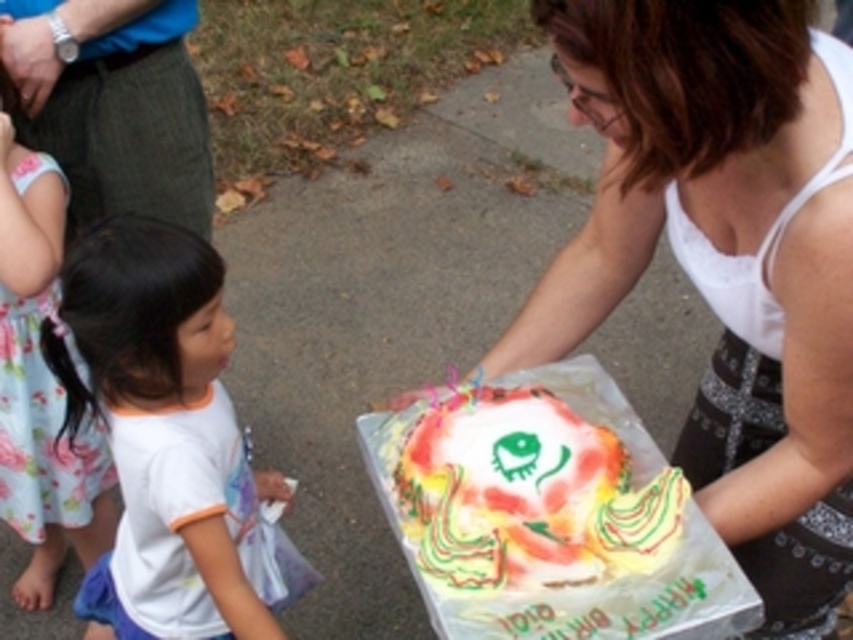
Question: Can you confirm if white matte tank top at center is thinner than white cotton shirt at lower left?

Choices:
 (A) no
 (B) yes

Answer: (A)

Question: Which is nearer to the white cotton shirt at lower left?

Choices:
 (A) floral fabric dress at lower left
 (B) white matte tank top at center

Answer: (A)

Question: Estimate the real-world distances between objects in this image. Which object is closer to the white cotton shirt at lower left?

Choices:
 (A) floral fabric dress at lower left
 (B) colorful frosting cake at center

Answer: (A)

Question: Considering the real-world distances, which object is farthest from the white matte tank top at center?

Choices:
 (A) floral fabric dress at lower left
 (B) white cotton shirt at lower left
 (C) colorful frosting cake at center

Answer: (A)

Question: Is white matte tank top at center wider than white cotton shirt at lower left?

Choices:
 (A) yes
 (B) no

Answer: (A)

Question: Does white matte tank top at center appear on the right side of white cotton shirt at lower left?

Choices:
 (A) no
 (B) yes

Answer: (B)